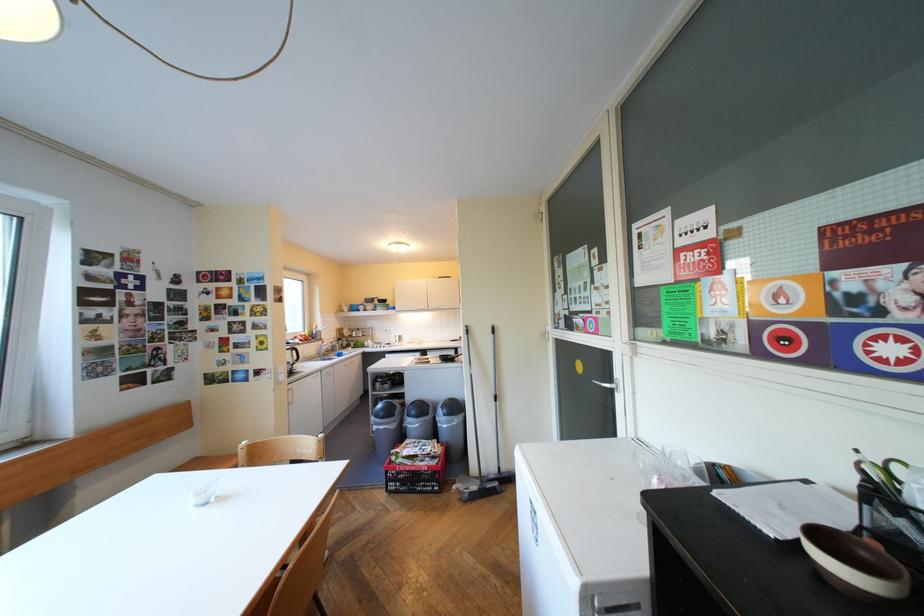
This screenshot has height=616, width=924. I want to click on red plastic crate, so click(x=416, y=467).